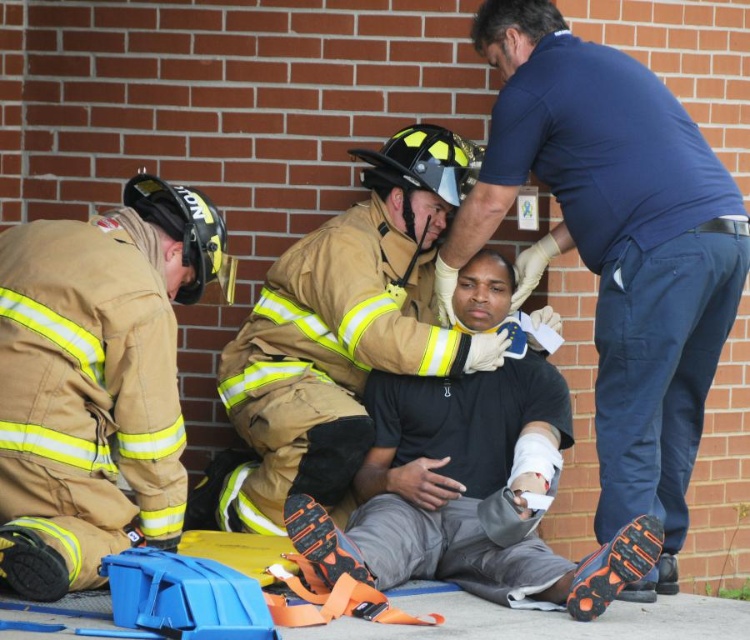
Question: Which of these objects is positioned closest to the brown leather helmet at left?

Choices:
 (A) brown leather jacket at center
 (B) blue cotton shirt at upper center
 (C) black matte shirt at center

Answer: (A)

Question: Does brown leather helmet at left appear on the right side of brown leather jacket at center?

Choices:
 (A) no
 (B) yes

Answer: (A)

Question: Does blue cotton shirt at upper center have a lesser width compared to brown leather jacket at center?

Choices:
 (A) yes
 (B) no

Answer: (A)

Question: Which point is closer to the camera taking this photo?

Choices:
 (A) (303, 362)
 (B) (514, 474)
 (C) (654, 582)

Answer: (C)

Question: Which of the following is the farthest from the observer?

Choices:
 (A) black matte shirt at center
 (B) brown leather jacket at center
 (C) brown leather helmet at left
 (D) blue cotton shirt at upper center

Answer: (B)

Question: Is blue cotton shirt at upper center bigger than brown leather helmet at left?

Choices:
 (A) no
 (B) yes

Answer: (B)